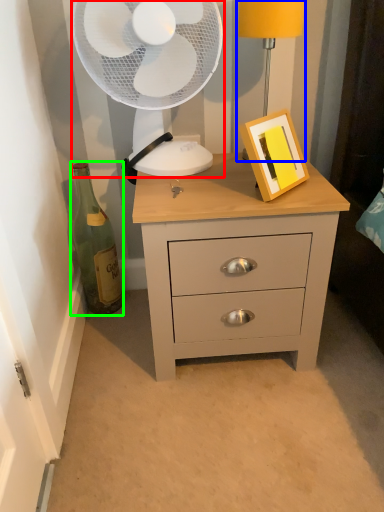
Question: Which is nearer to the mechanical fan (highlighted by a red box)? bedside lamp (highlighted by a blue box) or bottle (highlighted by a green box).

Choices:
 (A) bedside lamp
 (B) bottle

Answer: (A)